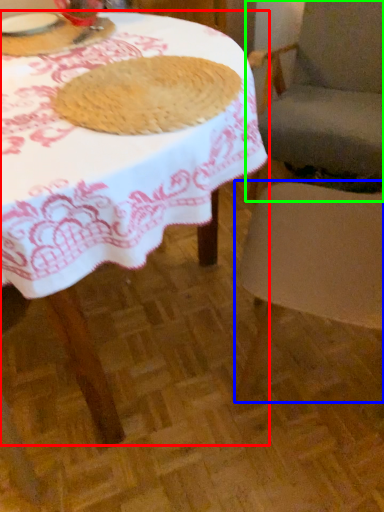
Question: Based on their relative distances, which object is farther from table (highlighted by a red box)? Choose from chair (highlighted by a blue box) and chair (highlighted by a green box).

Choices:
 (A) chair
 (B) chair

Answer: (B)